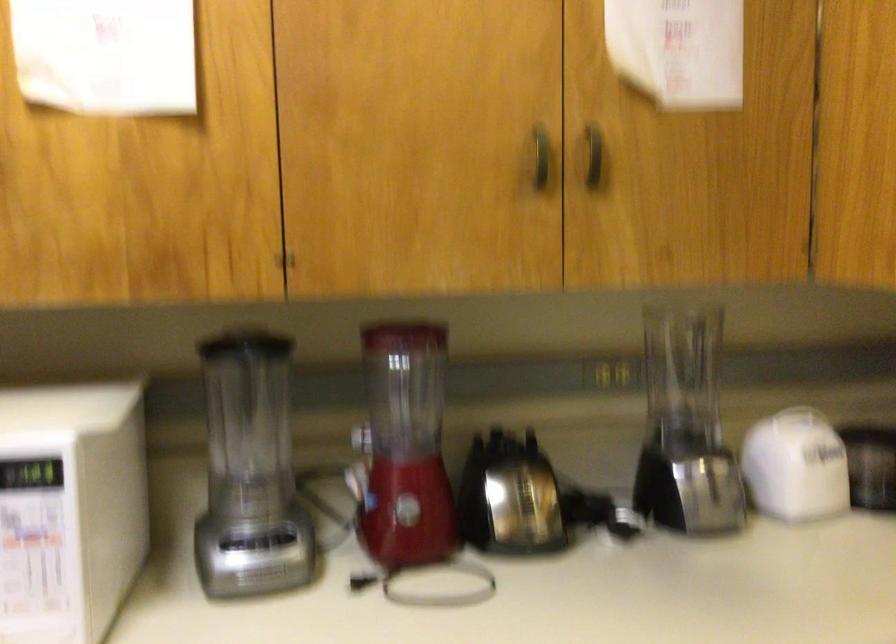
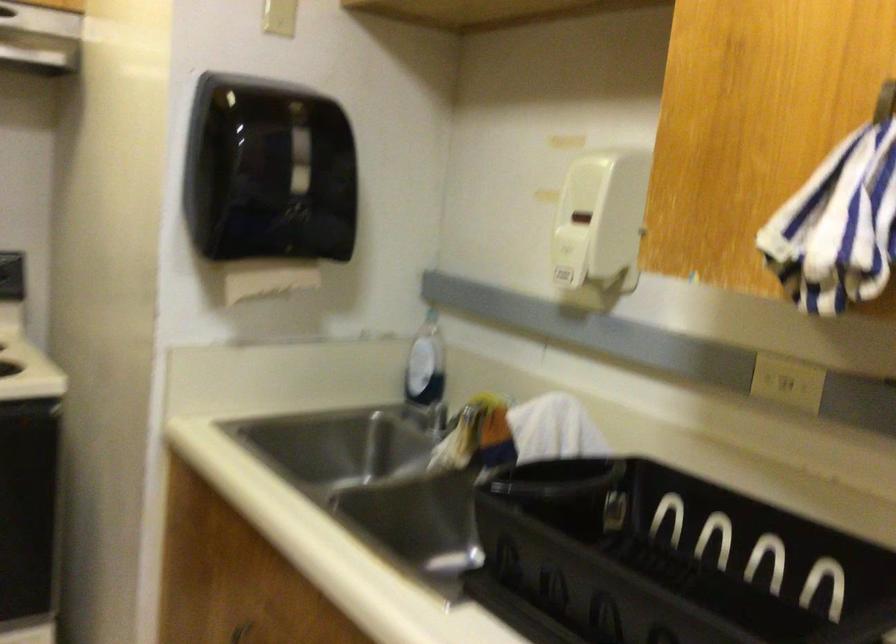
Question: How did the camera likely rotate?

Choices:
 (A) Left
 (B) Right
 (C) Up
 (D) Down

Answer: (B)